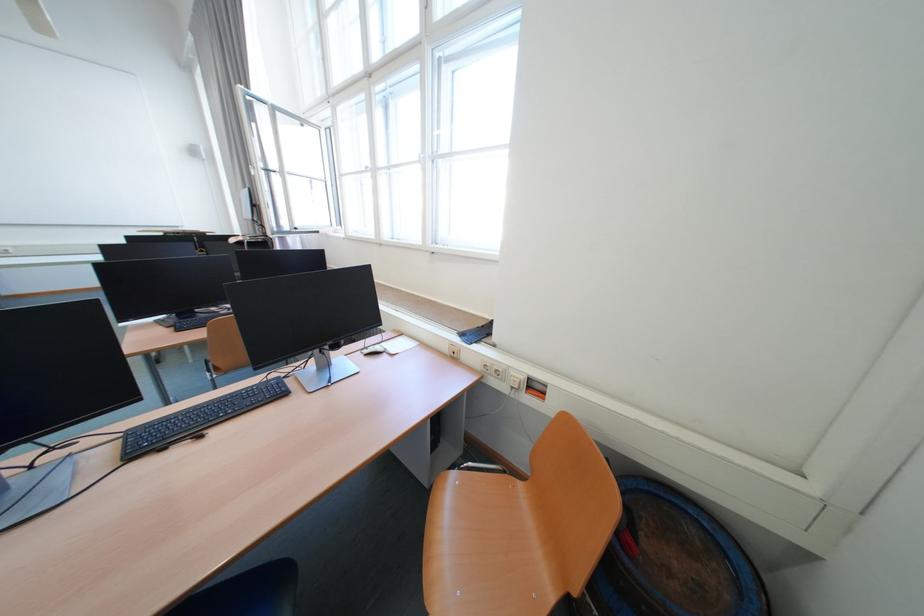
Where would you click the black computer mouse? Please return your answer as a coordinate pair (x, y).

(447, 416)